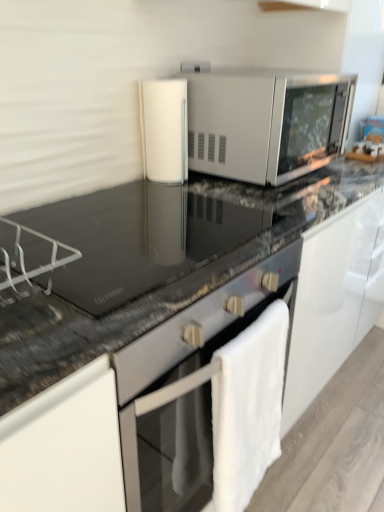
At what (x,y) coordinates should I click in order to perform the action: click on black granite countertop at center, the second countertop positioned from the top. Please return your answer as a coordinate pair (x, y). Looking at the image, I should click on (178, 309).

What do you see at coordinates (178, 309) in the screenshot? I see `black granite countertop at center, which is counted as the first countertop, starting from the bottom` at bounding box center [178, 309].

Describe the element at coordinates (266, 123) in the screenshot. I see `satin silver microwave at center` at that location.

The width and height of the screenshot is (384, 512). Describe the element at coordinates (164, 130) in the screenshot. I see `white glossy cylindrical container at center` at that location.

The image size is (384, 512). Find the location of `black granite countertop at center, which is counted as the first countertop, starting from the bottom`. black granite countertop at center, which is counted as the first countertop, starting from the bottom is located at coordinates (178, 309).

Considering the sizes of white glossy cylindrical container at center and black granite countertop at center, the second countertop positioned from the top, in the image, is white glossy cylindrical container at center bigger or smaller than black granite countertop at center, the second countertop positioned from the top,?

Considering their sizes, white glossy cylindrical container at center takes up less space than black granite countertop at center, the second countertop positioned from the top.

Can you confirm if white glossy cylindrical container at center is wider than black granite countertop at center, the second countertop positioned from the top?

Incorrect, the width of white glossy cylindrical container at center does not surpass that of black granite countertop at center, the second countertop positioned from the top.

Can you confirm if white glossy cylindrical container at center is taller than black granite countertop at center, the second countertop positioned from the top?

No, white glossy cylindrical container at center is not taller than black granite countertop at center, the second countertop positioned from the top.

Is white fluffy bath towel at lower right positioned beyond the bounds of black glass countertop at center, which is counted as the 2th countertop, starting from the bottom?

white fluffy bath towel at lower right is positioned outside black glass countertop at center, which is counted as the 2th countertop, starting from the bottom.

Which is farther from the camera, (236, 366) or (24, 232)?

Positioned behind is point (236, 366).

From the image's perspective, is white fluffy bath towel at lower right located above black glass countertop at center, which is counted as the 2th countertop, starting from the bottom?

Actually, white fluffy bath towel at lower right appears below black glass countertop at center, which is counted as the 2th countertop, starting from the bottom, in the image.

Considering the sizes of objects white fluffy bath towel at lower right and black glass countertop at center, the first countertop when ordered from top to bottom, in the image provided, who is shorter, white fluffy bath towel at lower right or black glass countertop at center, the first countertop when ordered from top to bottom,?

black glass countertop at center, the first countertop when ordered from top to bottom, is shorter.

Identify the location of countertop that appears behind the black granite countertop at center, which is counted as the first countertop, starting from the bottom. (184, 228).

From the image's perspective, who appears lower, black glass countertop at center, the first countertop when ordered from top to bottom, or black granite countertop at center, which is counted as the first countertop, starting from the bottom?

black granite countertop at center, which is counted as the first countertop, starting from the bottom, is shown below in the image.

Is black glass countertop at center, which is counted as the 2th countertop, starting from the bottom, next to black granite countertop at center, which is counted as the first countertop, starting from the bottom, and touching it?

Yes.

From the picture: Which of these two, black glass countertop at center, the first countertop when ordered from top to bottom, or black granite countertop at center, the second countertop positioned from the top, is smaller?

Smaller between the two is black glass countertop at center, the first countertop when ordered from top to bottom.

Considering the sizes of objects white fluffy bath towel at lower right and black granite countertop at center, which is counted as the first countertop, starting from the bottom, in the image provided, who is smaller, white fluffy bath towel at lower right or black granite countertop at center, which is counted as the first countertop, starting from the bottom,?

white fluffy bath towel at lower right is smaller.

From the image's perspective, which is below, white fluffy bath towel at lower right or black granite countertop at center, which is counted as the first countertop, starting from the bottom?

white fluffy bath towel at lower right appears lower in the image.

Relative to white glossy cylindrical container at center, is satin silver microwave at center in front or behind?

satin silver microwave at center is positioned closer to the viewer than white glossy cylindrical container at center.

From the image's perspective, relative to white glossy cylindrical container at center, is satin silver microwave at center above or below?

From the image's perspective, satin silver microwave at center appears above white glossy cylindrical container at center.

Which is nearer, [188,152] or [185,150]?

Positioned in front is point [185,150].

Is the position of black granite countertop at center, which is counted as the first countertop, starting from the bottom, more distant than that of white fluffy bath towel at lower right?

No, black granite countertop at center, which is counted as the first countertop, starting from the bottom, is in front of white fluffy bath towel at lower right.

From the image's perspective, is black granite countertop at center, the second countertop positioned from the top, positioned above or below white fluffy bath towel at lower right?

Based on their image positions, black granite countertop at center, the second countertop positioned from the top, is located above white fluffy bath towel at lower right.

Is black granite countertop at center, the second countertop positioned from the top, aimed at white fluffy bath towel at lower right?

Yes, black granite countertop at center, the second countertop positioned from the top, is oriented towards white fluffy bath towel at lower right.

Is black granite countertop at center, which is counted as the first countertop, starting from the bottom, next to white fluffy bath towel at lower right?

black granite countertop at center, which is counted as the first countertop, starting from the bottom, and white fluffy bath towel at lower right are not in contact.

Identify the location of the 1st countertop in front of the white fluffy bath towel at lower right. Image resolution: width=384 pixels, height=512 pixels. (184, 228).

From a real-world perspective, which is physically below, black glass countertop at center, the first countertop when ordered from top to bottom, or white fluffy bath towel at lower right?

In real-world perspective, white fluffy bath towel at lower right is lower.

Between black glass countertop at center, which is counted as the 2th countertop, starting from the bottom, and white fluffy bath towel at lower right, which one appears on the left side from the viewer's perspective?

From the viewer's perspective, black glass countertop at center, which is counted as the 2th countertop, starting from the bottom, appears more on the left side.

Would you consider black glass countertop at center, the first countertop when ordered from top to bottom, to be distant from white fluffy bath towel at lower right?

black glass countertop at center, the first countertop when ordered from top to bottom, is actually quite close to white fluffy bath towel at lower right.

Locate an element on the screen. The image size is (384, 512). appliance on the right of black granite countertop at center, which is counted as the first countertop, starting from the bottom is located at coordinates (164, 130).

Identify the location of bath towel below the black glass countertop at center, which is counted as the 2th countertop, starting from the bottom (from the image's perspective). (248, 407).

Estimate the real-world distances between objects in this image. Which object is closer to white glossy cylindrical container at center, white fluffy bath towel at lower right or black glass countertop at center, the first countertop when ordered from top to bottom?

The object closer to white glossy cylindrical container at center is black glass countertop at center, the first countertop when ordered from top to bottom.

When comparing their distances from white fluffy bath towel at lower right, does white glossy cylindrical container at center or satin silver microwave at center seem closer?

satin silver microwave at center lies closer to white fluffy bath towel at lower right than the other object.

Looking at the image, which one is located further to satin silver microwave at center, white fluffy bath towel at lower right or black glass countertop at center, the first countertop when ordered from top to bottom?

white fluffy bath towel at lower right.

From the image, which object appears to be farther from white glossy cylindrical container at center, black glass countertop at center, the first countertop when ordered from top to bottom, or white fluffy bath towel at lower right?

Among the two, white fluffy bath towel at lower right is located further to white glossy cylindrical container at center.

From the image, which object appears to be farther from black granite countertop at center, the second countertop positioned from the top, black glass countertop at center, which is counted as the 2th countertop, starting from the bottom, or white glossy cylindrical container at center?

white glossy cylindrical container at center is further to black granite countertop at center, the second countertop positioned from the top.

Considering their positions, is white glossy cylindrical container at center positioned closer to satin silver microwave at center than black granite countertop at center, the second countertop positioned from the top?

white glossy cylindrical container at center is closer to satin silver microwave at center.

Estimate the real-world distances between objects in this image. Which object is further from satin silver microwave at center, black glass countertop at center, which is counted as the 2th countertop, starting from the bottom, or white fluffy bath towel at lower right?

white fluffy bath towel at lower right.

Estimate the real-world distances between objects in this image. Which object is further from black granite countertop at center, which is counted as the first countertop, starting from the bottom, white fluffy bath towel at lower right or black glass countertop at center, the first countertop when ordered from top to bottom?

Among the two, white fluffy bath towel at lower right is located further to black granite countertop at center, which is counted as the first countertop, starting from the bottom.

Find the location of a particular element. This screenshot has height=512, width=384. microwave oven between black glass countertop at center, the first countertop when ordered from top to bottom, and white glossy cylindrical container at center in the front-back direction is located at coordinates (266, 123).

Where is `countertop between black glass countertop at center, which is counted as the 2th countertop, starting from the bottom, and white fluffy bath towel at lower right, in the vertical direction`? This screenshot has height=512, width=384. countertop between black glass countertop at center, which is counted as the 2th countertop, starting from the bottom, and white fluffy bath towel at lower right, in the vertical direction is located at coordinates (178, 309).

At what (x,y) coordinates should I click in order to perform the action: click on countertop between white glossy cylindrical container at center and black granite countertop at center, which is counted as the first countertop, starting from the bottom, from top to bottom. Please return your answer as a coordinate pair (x, y). The image size is (384, 512). Looking at the image, I should click on (184, 228).

Where is `appliance between satin silver microwave at center and black granite countertop at center, the second countertop positioned from the top, in the up-down direction`? The width and height of the screenshot is (384, 512). appliance between satin silver microwave at center and black granite countertop at center, the second countertop positioned from the top, in the up-down direction is located at coordinates (164, 130).